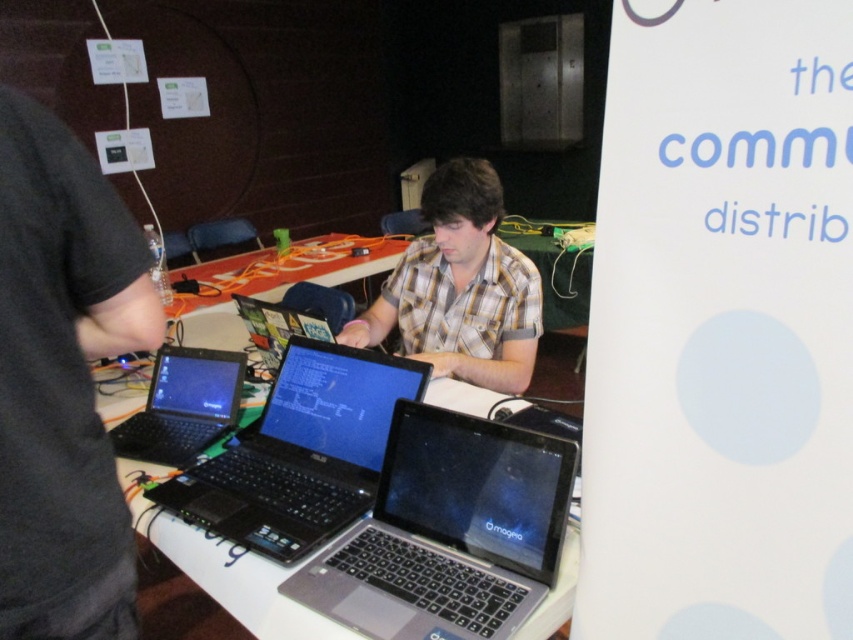
Question: Which point is closer to the camera taking this photo?

Choices:
 (A) (283, 324)
 (B) (131, 582)

Answer: (B)

Question: Can you confirm if black plastic laptop at center is wider than white plastic table at center?

Choices:
 (A) yes
 (B) no

Answer: (B)

Question: Which of the following is the closest to the observer?

Choices:
 (A) sleek silver laptop at center
 (B) black glossy laptop at center

Answer: (A)

Question: Does black plastic laptop at center appear on the right side of plaid fabric shirt at center?

Choices:
 (A) yes
 (B) no

Answer: (B)

Question: Does white plastic table at center appear on the right side of black glossy laptop at lower left?

Choices:
 (A) yes
 (B) no

Answer: (B)

Question: Which of the following is the farthest from the observer?

Choices:
 (A) (534, 515)
 (B) (216, 532)
 (C) (200, 444)

Answer: (C)